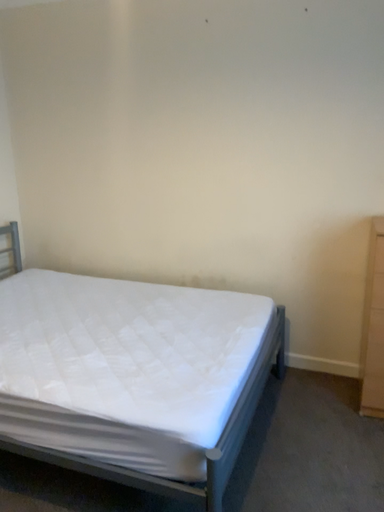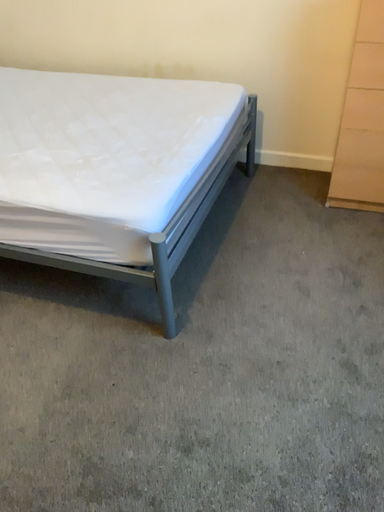
Question: Which way did the camera rotate in the video?

Choices:
 (A) rotated downward
 (B) rotated upward

Answer: (A)